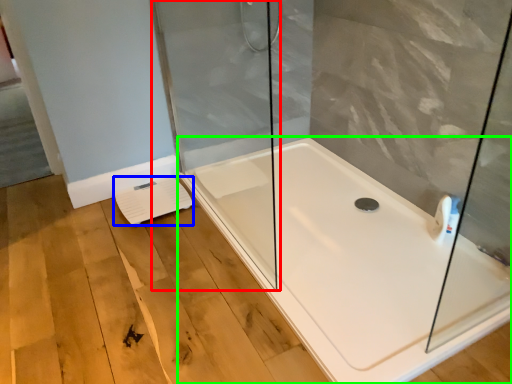
Question: Estimate the real-world distances between objects in this image. Which object is closer to shower door (highlighted by a red box), lift (highlighted by a blue box) or bathtub (highlighted by a green box)?

Choices:
 (A) lift
 (B) bathtub

Answer: (A)